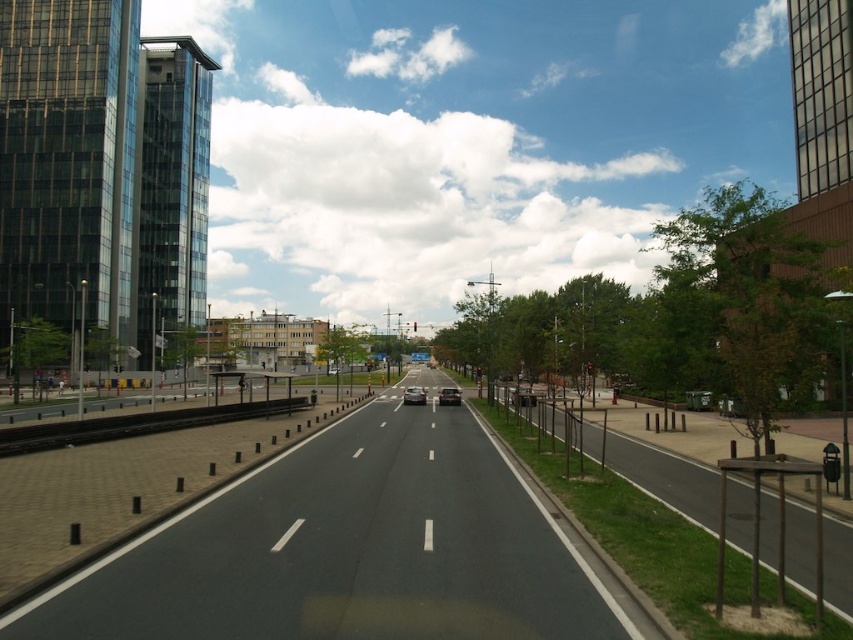
Measure the distance between point (461,506) and camera.

Point (461,506) is 38.37 feet from camera.

Which is in front, point (339, 538) or point (439, 401)?

Positioned in front is point (339, 538).

Which is behind, point (421, 570) or point (439, 400)?

The point (439, 400) is behind.

At what (x,y) coordinates should I click in order to perform the action: click on black asphalt highway at center. Please return your answer as a coordinate pair (x, y). Image resolution: width=853 pixels, height=640 pixels. Looking at the image, I should click on (351, 548).

Is the position of black asphalt highway at center more distant than that of metallic silver car at center?

That is False.

How far apart are black asphalt highway at center and metallic silver car at center?

The distance of black asphalt highway at center from metallic silver car at center is 18.13 feet.

I want to click on black asphalt highway at center, so click(351, 548).

Does metallic silver car at center have a lesser width compared to shiny silver car at center?

Incorrect, metallic silver car at center's width is not less than shiny silver car at center's.

Which is in front, point (512, 388) or point (412, 397)?

Point (412, 397)

Where is `metallic silver car at center`? This screenshot has width=853, height=640. metallic silver car at center is located at coordinates (521, 396).